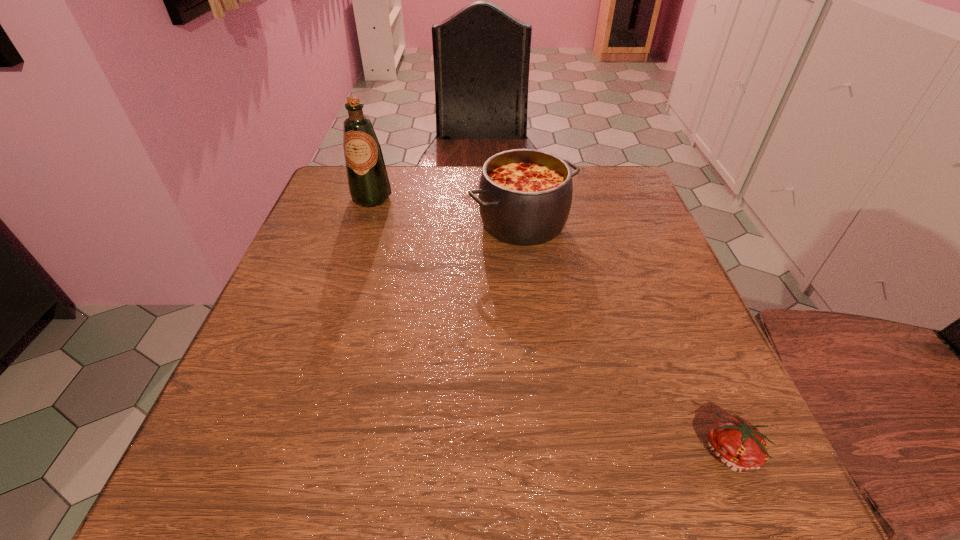
I want to click on olive oil, so [368, 182].

Find the location of `the leftmost object`. the leftmost object is located at coordinates (368, 182).

The width and height of the screenshot is (960, 540). Find the location of `the second tallest object`. the second tallest object is located at coordinates (525, 195).

I want to click on the second object from right to left, so click(525, 195).

At what (x,y) coordinates should I click in order to perform the action: click on the shortest object. Please return your answer as a coordinate pair (x, y). This screenshot has height=540, width=960. Looking at the image, I should click on (736, 443).

At what (x,y) coordinates should I click in order to perform the action: click on tomato. Please return your answer as a coordinate pair (x, y). Looking at the image, I should click on tap(736, 443).

Find the location of a particular element. blank area located 0.350m on the front-facing side of the leftmost object is located at coordinates (332, 316).

Where is `vacant space situated on the front of the second object from left to right`? The height and width of the screenshot is (540, 960). vacant space situated on the front of the second object from left to right is located at coordinates (530, 284).

Locate an element on the screen. This screenshot has width=960, height=540. vacant area situated 0.170m on the back of the rightmost object is located at coordinates point(683,338).

The height and width of the screenshot is (540, 960). I want to click on olive oil at the far edge, so click(368, 182).